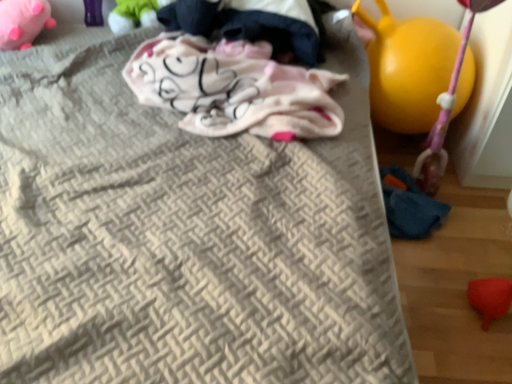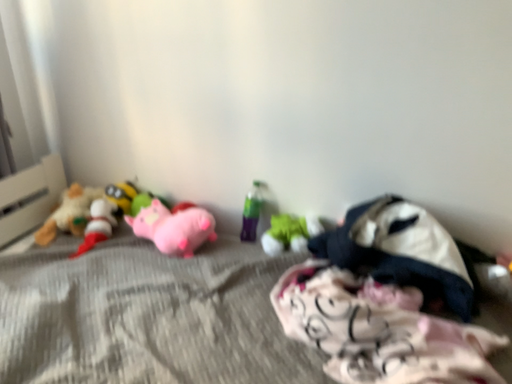
Question: How did the camera likely rotate when shooting the video?

Choices:
 (A) rotated upward
 (B) rotated downward

Answer: (A)